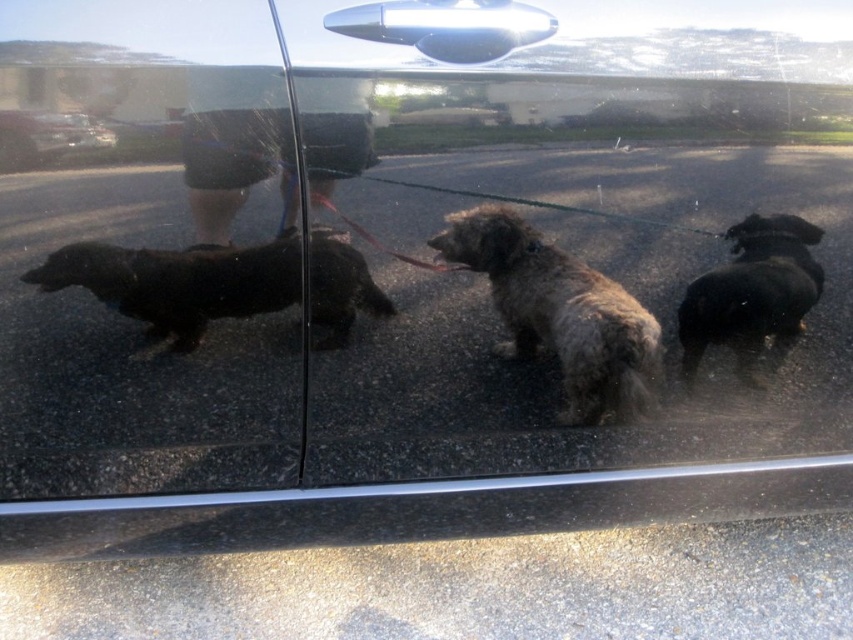
Question: Does fuzzy brown dog at center have a greater width compared to black shaggy dog at left?

Choices:
 (A) no
 (B) yes

Answer: (A)

Question: Considering the real-world distances, which object is closest to the fuzzy brown dog at center?

Choices:
 (A) black matte dog at right
 (B) glossy black car at upper left
 (C) black shaggy dog at left

Answer: (A)

Question: Which is nearer to the glossy black car at upper left?

Choices:
 (A) black shaggy dog at left
 (B) fuzzy brown dog at center

Answer: (A)

Question: Can you confirm if black shaggy dog at left is positioned to the right of glossy black car at upper left?

Choices:
 (A) no
 (B) yes

Answer: (B)

Question: Does fuzzy brown dog at center have a larger size compared to glossy black car at upper left?

Choices:
 (A) no
 (B) yes

Answer: (B)

Question: Which of the following is the farthest from the observer?

Choices:
 (A) black shaggy dog at left
 (B) black matte dog at right
 (C) glossy black car at upper left

Answer: (B)